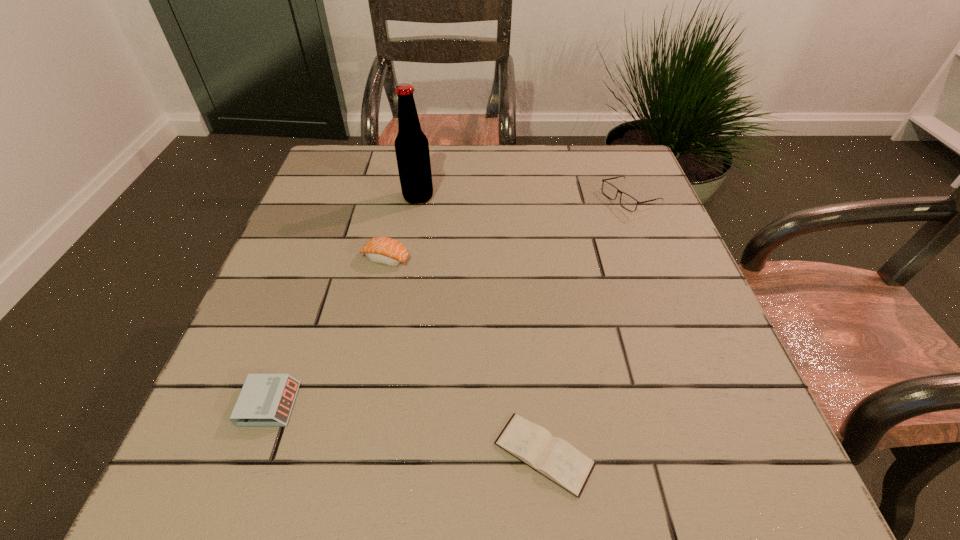
At what (x,y) coordinates should I click in order to perform the action: click on vacant space that's between the alarm clock and the rightmost object. Please return your answer as a coordinate pair (x, y). This screenshot has height=540, width=960. Looking at the image, I should click on (449, 302).

Where is `free area in between the spectacles and the second shortest object`? free area in between the spectacles and the second shortest object is located at coordinates click(x=449, y=302).

You are a GUI agent. You are given a task and a screenshot of the screen. Output one action in this format:
    pyautogui.click(x=<x>, y=<y>)
    Task: Click on the empty space that is in between the tallest object and the sushi
    The height and width of the screenshot is (540, 960).
    Given the screenshot: What is the action you would take?
    pyautogui.click(x=402, y=228)

Find the location of `vacant area between the spectacles and the shortest object`. vacant area between the spectacles and the shortest object is located at coordinates (587, 327).

Where is `empty space between the sushi and the rightmost object`? The height and width of the screenshot is (540, 960). empty space between the sushi and the rightmost object is located at coordinates (508, 229).

Find the location of `vacant point located between the shortest object and the beer bottle`. vacant point located between the shortest object and the beer bottle is located at coordinates (481, 326).

Identify the location of blank region between the fourth object from left to right and the rightmost object. The width and height of the screenshot is (960, 540). (587, 327).

Identify which object is the third nearest to the beer bottle. Please provide its 2D coordinates. Your answer should be formatted as a tuple, i.e. [(x, y)], where the tuple contains the x and y coordinates of a point satisfying the conditions above.

[(266, 400)]

You are a GUI agent. You are given a task and a screenshot of the screen. Output one action in this format:
    pyautogui.click(x=<x>, y=<y>)
    Task: Click on the object identified as the fourth closest to the rightmost object
    The height and width of the screenshot is (540, 960).
    Given the screenshot: What is the action you would take?
    pyautogui.click(x=266, y=400)

This screenshot has width=960, height=540. What are the coordinates of `vacant region that satisfies the following two spatial constraints: 1. with the lenses facing outward on the rightmost object; 2. on the front side of the second shortest object` in the screenshot? It's located at (709, 404).